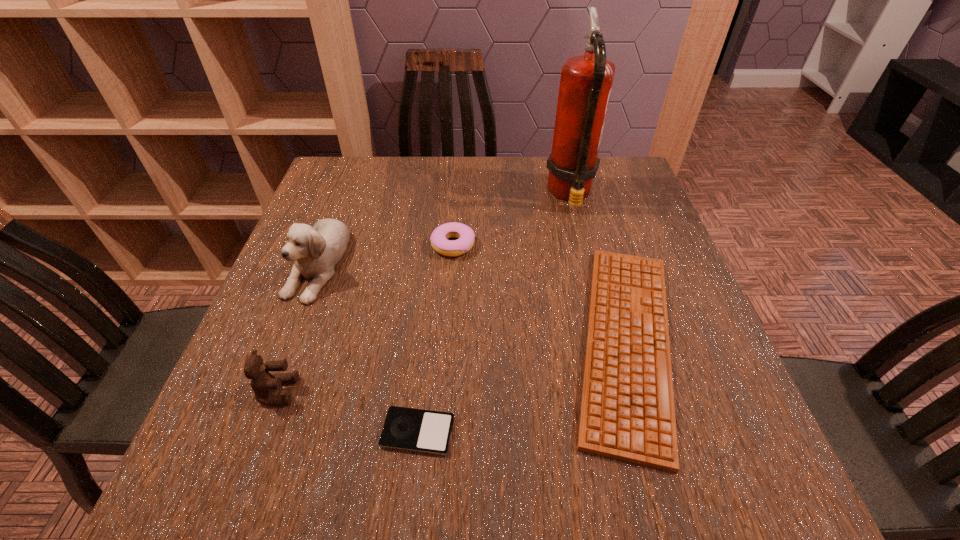
Where is `free space at the near right corner of the desktop`? free space at the near right corner of the desktop is located at coordinates (699, 450).

Identify the location of free area in between the fifth tallest object and the puppy. (471, 302).

Identify the location of vacant region between the puppy and the third tallest object. (298, 327).

I want to click on free space between the puppy and the second shortest object, so click(x=471, y=302).

Find the location of a particular element. Image resolution: width=960 pixels, height=540 pixels. empty space that is in between the tallest object and the third tallest object is located at coordinates (424, 293).

Identify the location of free space between the shortest object and the third tallest object. Image resolution: width=960 pixels, height=540 pixels. (348, 411).

You are a GUI agent. You are given a task and a screenshot of the screen. Output one action in this format:
    pyautogui.click(x=<x>, y=<y>)
    Task: Click on the vacant point located between the puppy and the second shortest object
    The height and width of the screenshot is (540, 960).
    Given the screenshot: What is the action you would take?
    pyautogui.click(x=471, y=302)

The width and height of the screenshot is (960, 540). Identify the location of vacant space in between the puppy and the computer keyboard. (471, 302).

Locate an element on the screen. This screenshot has height=540, width=960. free space between the tallest object and the iPod is located at coordinates (493, 313).

Find the location of a particular element. unoccupied area between the second shortest object and the doughnut is located at coordinates (540, 293).